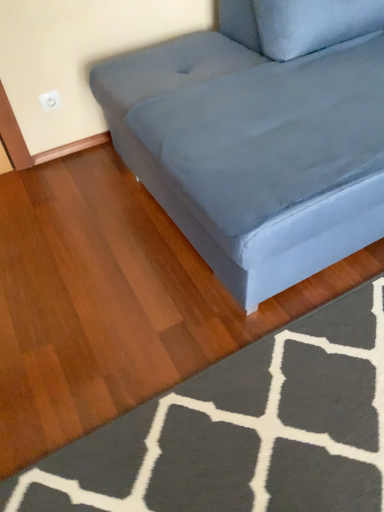
Question: Should I look upward or downward to see suede-like gray couch at center?

Choices:
 (A) down
 (B) up

Answer: (B)

Question: Could you tell me if dark gray textured rug at lower right is turned towards suede-like gray couch at center?

Choices:
 (A) no
 (B) yes

Answer: (A)

Question: From the image's perspective, is dark gray textured rug at lower right above suede-like gray couch at center?

Choices:
 (A) no
 (B) yes

Answer: (A)

Question: Is dark gray textured rug at lower right to the right of suede-like gray couch at center from the viewer's perspective?

Choices:
 (A) yes
 (B) no

Answer: (B)

Question: Can you confirm if dark gray textured rug at lower right is taller than suede-like gray couch at center?

Choices:
 (A) yes
 (B) no

Answer: (B)

Question: Is dark gray textured rug at lower right surrounding suede-like gray couch at center?

Choices:
 (A) yes
 (B) no

Answer: (B)

Question: Does dark gray textured rug at lower right have a greater width compared to suede-like gray couch at center?

Choices:
 (A) no
 (B) yes

Answer: (A)

Question: Are suede-like gray couch at center and dark gray textured rug at lower right located far from each other?

Choices:
 (A) no
 (B) yes

Answer: (A)

Question: Are suede-like gray couch at center and dark gray textured rug at lower right making contact?

Choices:
 (A) no
 (B) yes

Answer: (A)

Question: Does suede-like gray couch at center lie behind dark gray textured rug at lower right?

Choices:
 (A) yes
 (B) no

Answer: (B)

Question: From a real-world perspective, is suede-like gray couch at center located beneath dark gray textured rug at lower right?

Choices:
 (A) no
 (B) yes

Answer: (A)

Question: From a real-world perspective, is suede-like gray couch at center on top of dark gray textured rug at lower right?

Choices:
 (A) yes
 (B) no

Answer: (A)

Question: Is suede-like gray couch at center turned away from dark gray textured rug at lower right?

Choices:
 (A) yes
 (B) no

Answer: (B)

Question: Which is correct: suede-like gray couch at center is inside dark gray textured rug at lower right, or outside of it?

Choices:
 (A) inside
 (B) outside

Answer: (B)